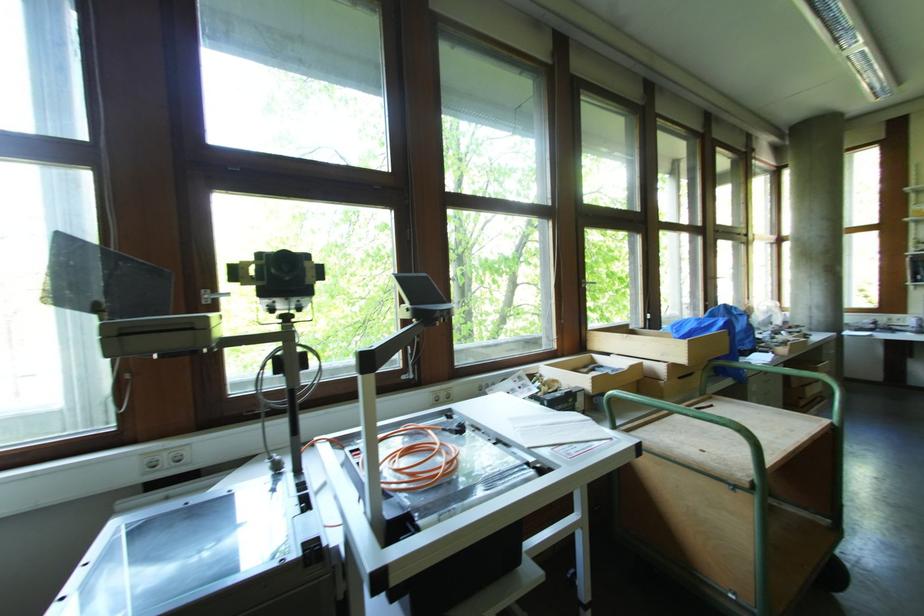
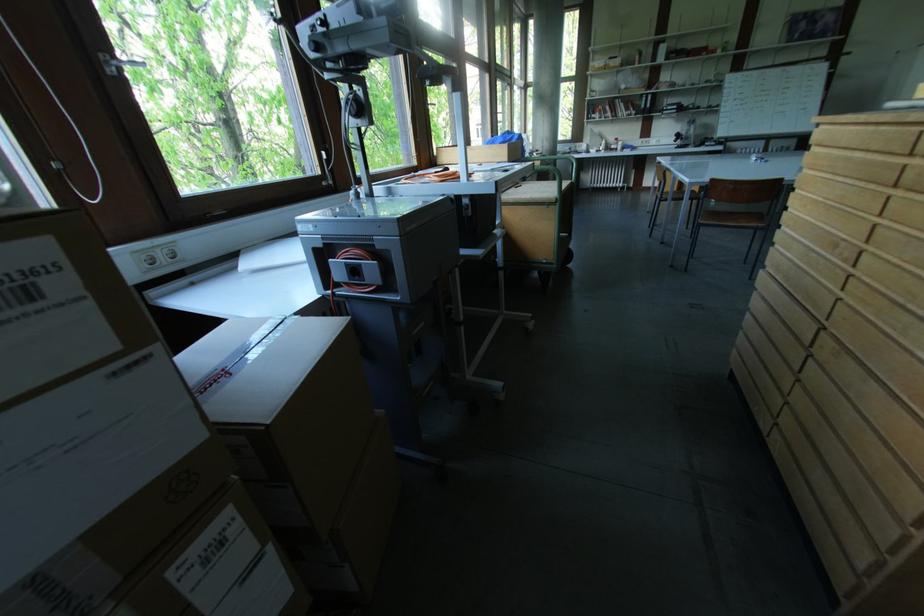
The point at (718, 331) is marked in the first image. Where is the corresponding point in the second image?

(516, 144)